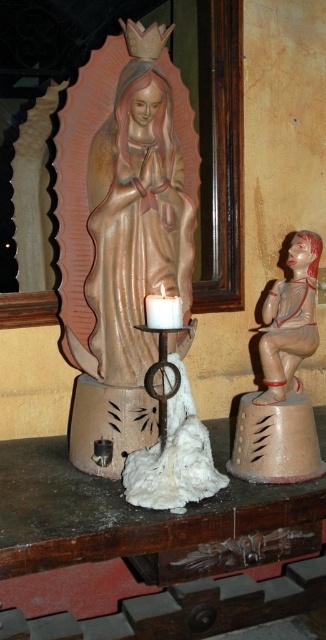
Is wooden table at center further to camera compared to white matte candle holder at center?

No.

Can you confirm if wooden table at center is smaller than white matte candle holder at center?

Incorrect, wooden table at center is not smaller in size than white matte candle holder at center.

Who is more forward, [222,509] or [173,326]?

Point [222,509]

Where is `wooden table at center`? wooden table at center is located at coordinates (158, 547).

Does point (302, 333) lie behind point (159, 308)?

Yes, point (302, 333) is behind point (159, 308).

Which is above, matte brown figurine at right or white matte candle holder at center?

white matte candle holder at center is higher up.

Locate an element on the screen. Image resolution: width=326 pixels, height=640 pixels. matte brown figurine at right is located at coordinates (290, 320).

This screenshot has height=640, width=326. Find the location of `matte brown figurine at right`. matte brown figurine at right is located at coordinates click(290, 320).

Consider the image. Which is more to the right, wooden table at center or matte gold statue at center?

wooden table at center is more to the right.

Looking at this image, does wooden table at center have a greater height compared to matte gold statue at center?

No, wooden table at center is not taller than matte gold statue at center.

Is point (84, 557) behind point (163, 145)?

No.

What are the coordinates of `wooden table at center` in the screenshot? It's located at 158,547.